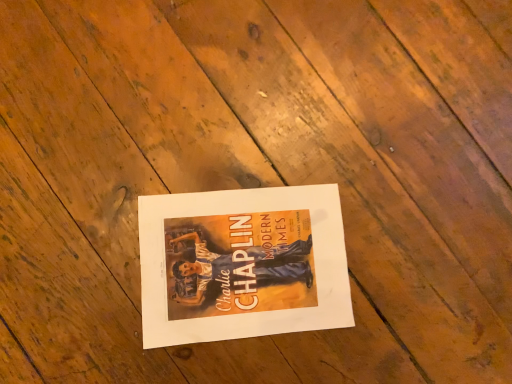
Where is `vacant space underneath matte paper poster at center (from a real-world perspective)`? Image resolution: width=512 pixels, height=384 pixels. vacant space underneath matte paper poster at center (from a real-world perspective) is located at coordinates (241, 258).